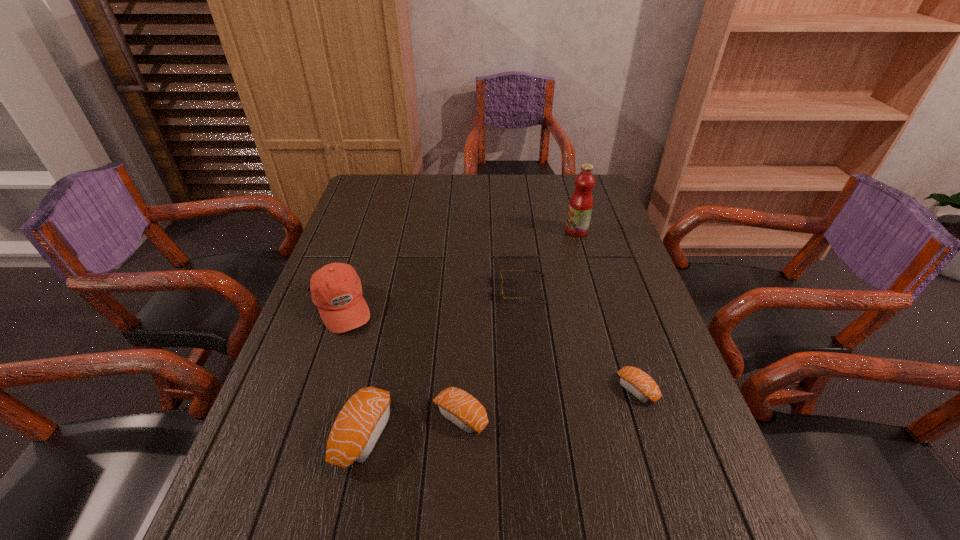
At what (x,y) coordinates should I click in order to perform the action: click on object at the left edge. Please return your answer as a coordinate pair (x, y). This screenshot has width=960, height=540. Looking at the image, I should click on (336, 289).

Find the location of a particular element. Image resolution: width=960 pixels, height=540 pixels. sushi that is at the right edge is located at coordinates (637, 382).

This screenshot has width=960, height=540. Identify the location of fruit juice present at the right edge. (581, 202).

Image resolution: width=960 pixels, height=540 pixels. I want to click on free space at the far edge of the desktop, so click(468, 193).

In the image, there is a desktop. Where is `free space at the near edge`? Image resolution: width=960 pixels, height=540 pixels. free space at the near edge is located at coordinates (322, 493).

Where is `vacant space at the left edge`? vacant space at the left edge is located at coordinates (250, 442).

Identify the location of vacant space at the right edge of the desktop. The width and height of the screenshot is (960, 540). (610, 314).

Locate an element on the screen. vacant area that lies between the leftmost sushi and the fruit juice is located at coordinates (470, 332).

Where is `vacant area that lies between the second tallest sushi and the farthest object`? The width and height of the screenshot is (960, 540). vacant area that lies between the second tallest sushi and the farthest object is located at coordinates pyautogui.click(x=518, y=324).

Locate an element on the screen. The width and height of the screenshot is (960, 540). vacant area that lies between the second tallest object and the sunglasses is located at coordinates (432, 298).